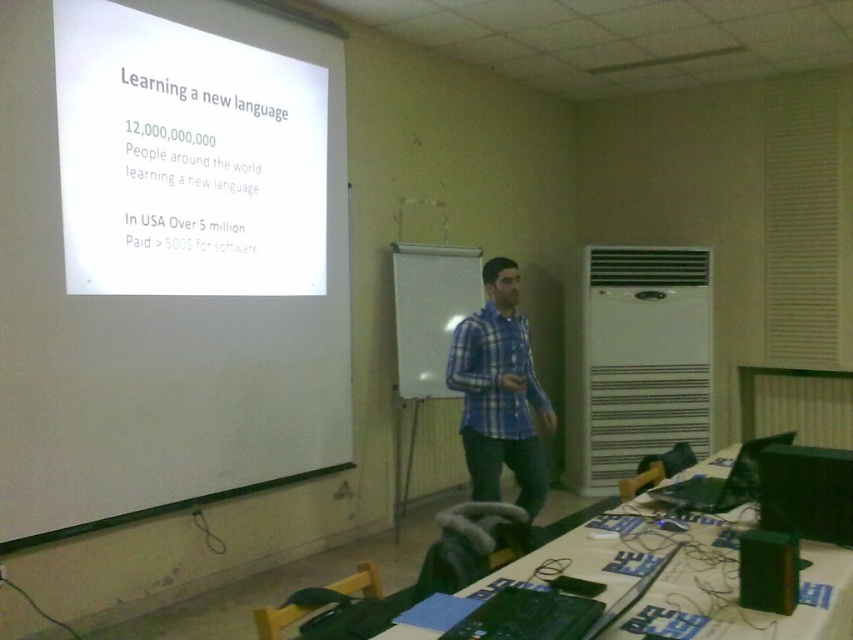
Question: Estimate the real-world distances between objects in this image. Which object is closer to the green fabric table at lower right?

Choices:
 (A) green matte book at lower right
 (B) whiteboard at center
 (C) white paper at upper left
 (D) blue plaid shirt at center

Answer: (A)

Question: Can you confirm if white matte projection screen at upper left is positioned above green fabric table at lower right?

Choices:
 (A) yes
 (B) no

Answer: (A)

Question: Which point is closer to the camera?

Choices:
 (A) (451, 301)
 (B) (634, 611)
 (C) (693, 477)

Answer: (B)

Question: Is green fabric table at lower right to the right of green matte book at lower right from the viewer's perspective?

Choices:
 (A) no
 (B) yes

Answer: (A)

Question: Can you confirm if whiteboard at center is positioned to the left of green matte book at lower right?

Choices:
 (A) no
 (B) yes

Answer: (B)

Question: Which object is the closest to the green fabric table at lower right?

Choices:
 (A) white matte projection screen at upper left
 (B) whiteboard at center

Answer: (B)